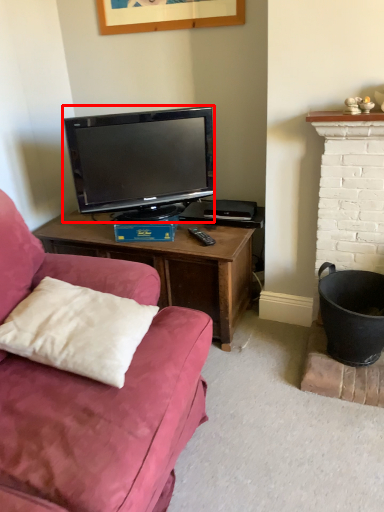
Question: Where is television (annotated by the red box) located in relation to pillow in the image?

Choices:
 (A) left
 (B) right

Answer: (B)